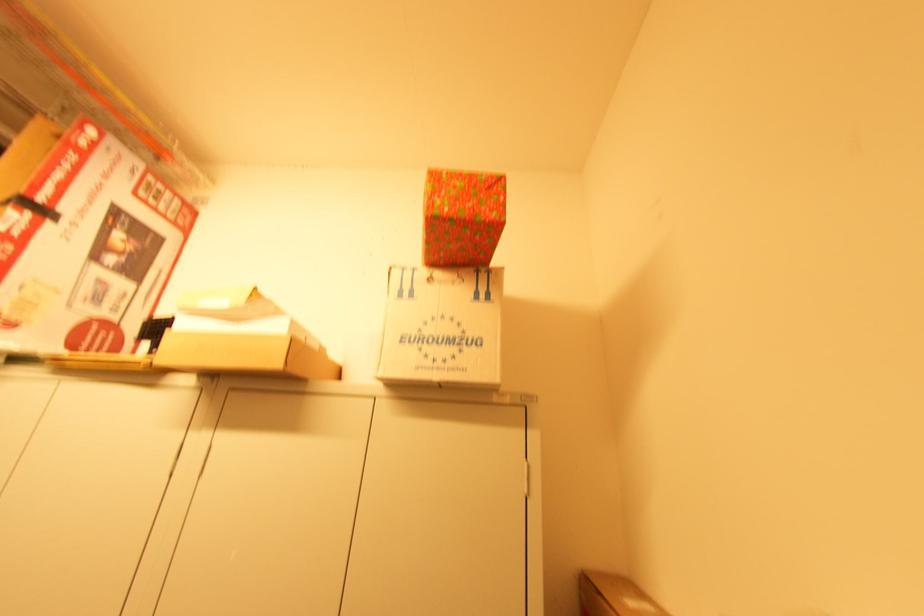
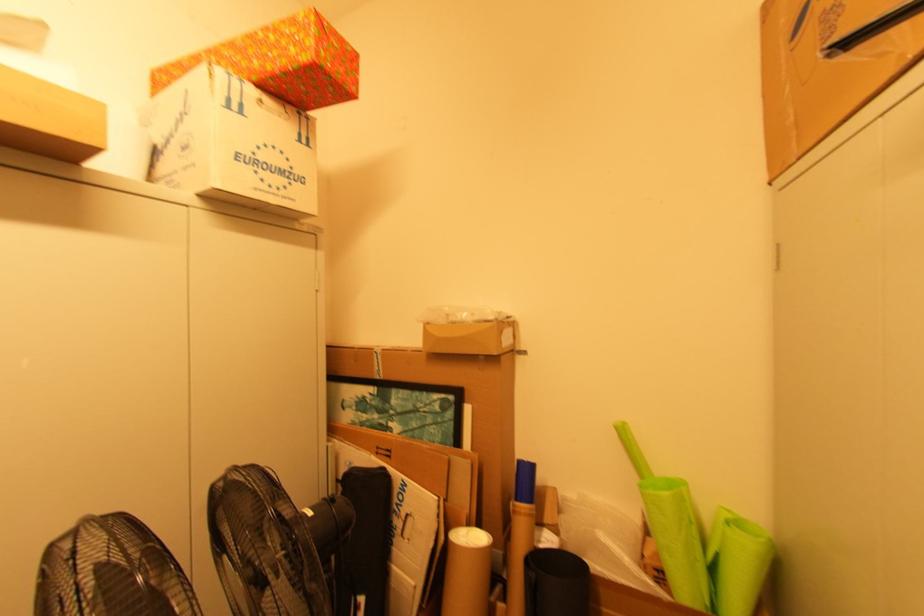
In the second image, find the point that corresponds to the point at 422,331 in the first image.

(257, 154)